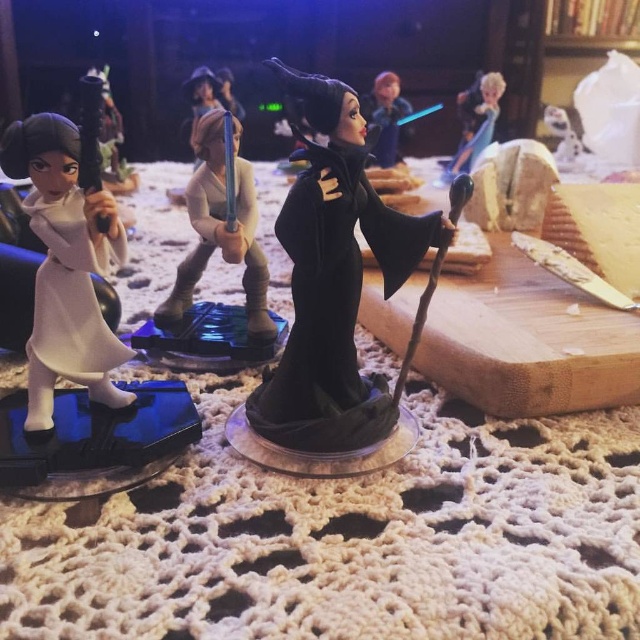
You are a collector organizing a shelf and need to place the white glossy figure at left and the satin gold armor at center. Based on their positions in the image, which one should you place first to maintain the original arrangement?

The white glossy figure at left should be placed first because it is in front of the satin gold armor at center in the original arrangement.

You are a collector examining the arrangement of figurines on the doily. You notice two specific points marked on the doily surface. Which of these points, point (x=35, y=298) or point (x=192, y=196), is positioned closer to your viewpoint?

Point (x=35, y=298) is closer to the viewer than point (x=192, y=196).

You are a collector arranging figurines on a doily. You have two points marked on the doily at coordinates point (284, 406) and point (51, 330). If you want to place a new figurine in front of both points, where should you position it relative to these points?

To place the new figurine in front of both points, it should be positioned in front of point (51, 330) since point (284, 406) is behind point (51, 330), and placing it in front of the closer point would also place it in front of the farther one.